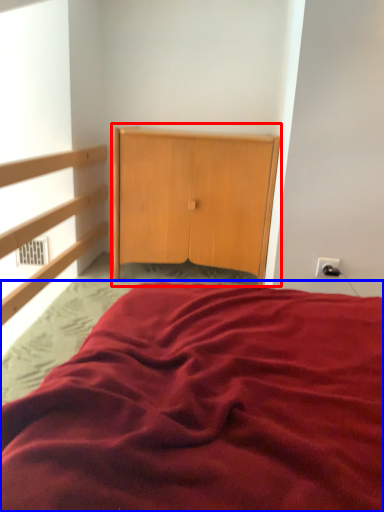
Question: Which object is further to the camera taking this photo, dresser (highlighted by a red box) or bed (highlighted by a blue box)?

Choices:
 (A) dresser
 (B) bed

Answer: (A)